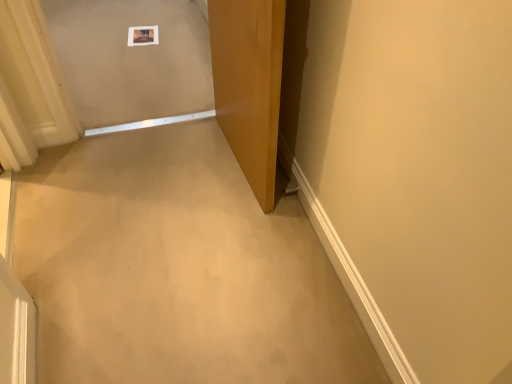
Find the location of `wooden door at center`. wooden door at center is located at coordinates (249, 85).

The height and width of the screenshot is (384, 512). What do you see at coordinates (249, 85) in the screenshot?
I see `wooden door at center` at bounding box center [249, 85].

You are a GUI agent. You are given a task and a screenshot of the screen. Output one action in this format:
    pyautogui.click(x=<x>, y=<y>)
    Task: Click on the wooden door at center
    
    Given the screenshot: What is the action you would take?
    pyautogui.click(x=249, y=85)